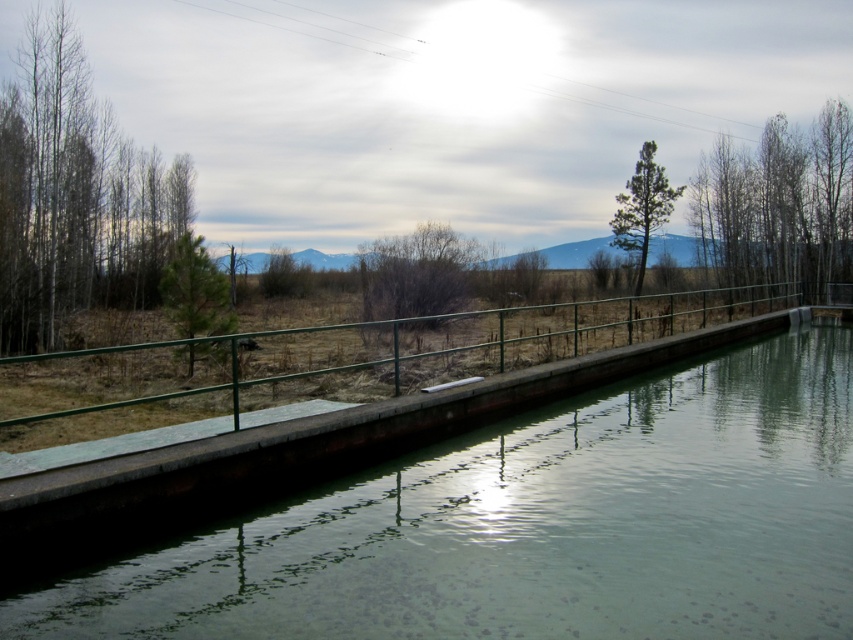
Which of these two, green concrete river at center or green metal rail at center, stands taller?

green metal rail at center is taller.

Does green concrete river at center have a lesser width compared to green metal rail at center?

Yes.

Is point (3, 625) positioned after point (605, 310)?

No, (3, 625) is in front of (605, 310).

This screenshot has width=853, height=640. Identify the location of green concrete river at center. (537, 525).